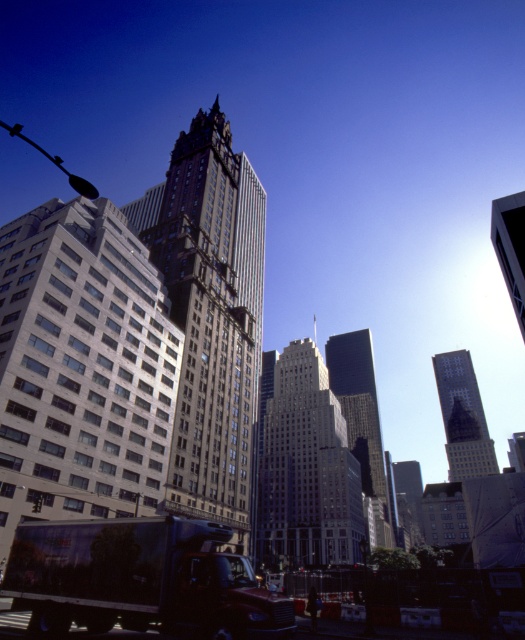
You are a photographer standing in the middle of the city. You want to take a photo of the metallic silver truck at lower left and the reflective glass skyscraper at center. Which object will appear larger in the photo?

The metallic silver truck at lower left will appear larger in the photo because it is positioned above the reflective glass skyscraper at center, making it closer to the camera.

You are an architect analyzing the urban skyline. You observe the shiny glass skyscraper at center and the smooth gray skyscraper at center. Which one has a greater height?

The shiny glass skyscraper at center is much taller than the smooth gray skyscraper at center, so it has a greater height.

What are the coordinates of the gray stone building at center?

The gray stone building at center is located at coordinates point (81, 368).